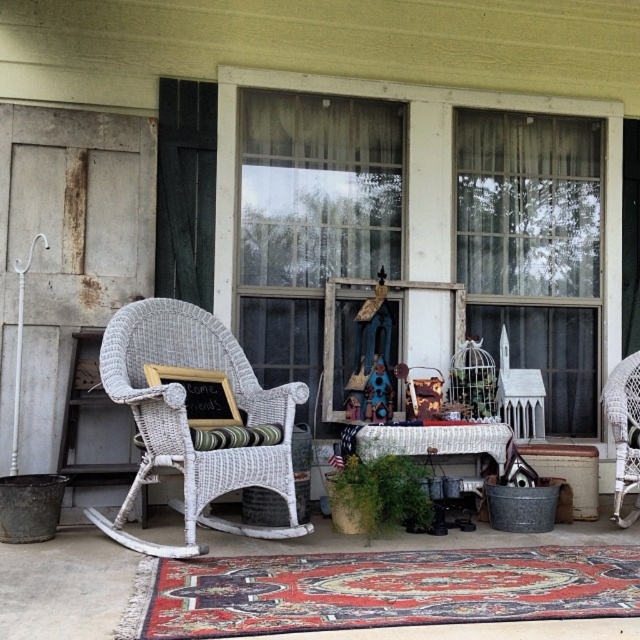
From the picture: Between white wicker rocking chair at left and white wicker chair at right, which one appears on the left side from the viewer's perspective?

white wicker rocking chair at left is more to the left.

Which is below, white wicker rocking chair at left or white wicker chair at right?

white wicker chair at right is below.

Does point (305, 531) come behind point (624, 406)?

That is False.

Identify the location of white wicker rocking chair at left. The width and height of the screenshot is (640, 640). (196, 419).

Does white wicker rocking chair at left appear under blue fabric doll at center?

Yes.

Does white wicker rocking chair at left lie behind blue fabric doll at center?

That is False.

I want to click on white wicker rocking chair at left, so coord(196,419).

Is white wicker chair at right positioned in front of blue fabric doll at center?

Yes.

Locate an element on the screen. white wicker chair at right is located at coordinates (625, 433).

Where is `white wicker chair at right`? white wicker chair at right is located at coordinates (625, 433).